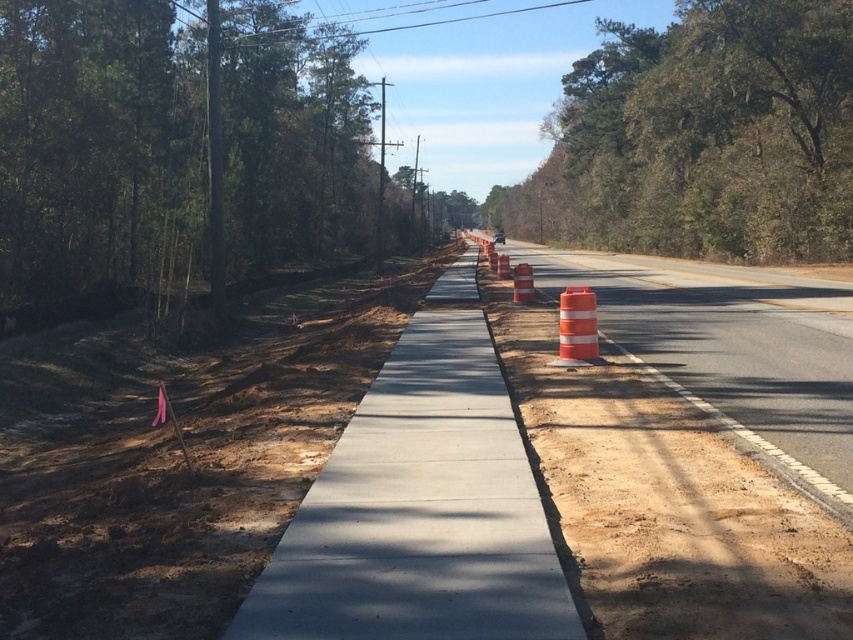
Can you confirm if orange reflective cone at center is positioned below orange reflective cone at right?

Incorrect, orange reflective cone at center is not positioned below orange reflective cone at right.

Is orange reflective cone at center smaller than orange reflective cone at right?

Incorrect, orange reflective cone at center is not smaller in size than orange reflective cone at right.

Measure the distance between point (x=538, y=484) and camera.

18.09 feet

Identify the location of orange reflective cone at center. pyautogui.click(x=688, y=456).

Which is in front, point (9, 12) or point (567, 307)?

Point (567, 307) is more forward.

Where is `green leafy tree at left`? green leafy tree at left is located at coordinates (169, 152).

Can you confirm if green leafy tree at upper center is positioned below smooth concrete sidewalk at center?

No.

The image size is (853, 640). Identify the location of green leafy tree at upper center. coord(701,138).

The image size is (853, 640). I want to click on green leafy tree at upper center, so click(701, 138).

Locate an element on the screen. Image resolution: width=853 pixels, height=640 pixels. green leafy tree at upper center is located at coordinates (701, 138).